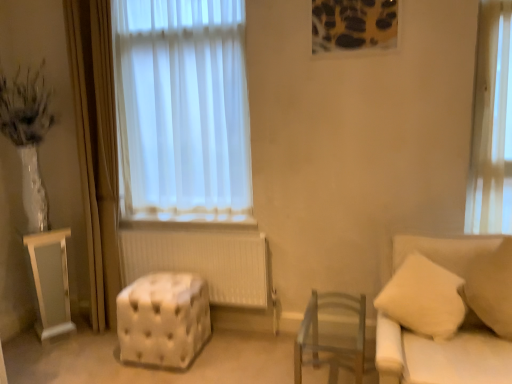
Question: Considering the relative sizes of white fabric couch at right and white tufted ottoman at center in the image provided, is white fabric couch at right taller than white tufted ottoman at center?

Choices:
 (A) yes
 (B) no

Answer: (A)

Question: From the image's perspective, is white fabric couch at right beneath white tufted ottoman at center?

Choices:
 (A) no
 (B) yes

Answer: (A)

Question: Is white fabric couch at right bigger than white tufted ottoman at center?

Choices:
 (A) yes
 (B) no

Answer: (A)

Question: Can we say white fabric couch at right lies outside white tufted ottoman at center?

Choices:
 (A) yes
 (B) no

Answer: (A)

Question: Does white fabric couch at right appear on the right side of white tufted ottoman at center?

Choices:
 (A) yes
 (B) no

Answer: (A)

Question: Considering their positions, is beige fabric pillow at right located in front of or behind white fabric couch at right?

Choices:
 (A) behind
 (B) front

Answer: (A)

Question: Would you say beige fabric pillow at right is to the left or to the right of white fabric couch at right in the picture?

Choices:
 (A) left
 (B) right

Answer: (B)

Question: Considering the positions of beige fabric pillow at right and white fabric couch at right in the image, is beige fabric pillow at right bigger or smaller than white fabric couch at right?

Choices:
 (A) small
 (B) big

Answer: (A)

Question: Considering the positions of beige fabric pillow at right and white fabric couch at right in the image, is beige fabric pillow at right wider or thinner than white fabric couch at right?

Choices:
 (A) thin
 (B) wide

Answer: (A)

Question: In terms of size, does clear wood chair at center appear bigger or smaller than beige fabric pillow at right?

Choices:
 (A) small
 (B) big

Answer: (B)

Question: Is clear wood chair at center wider or thinner than beige fabric pillow at right?

Choices:
 (A) thin
 (B) wide

Answer: (B)

Question: In terms of height, does clear wood chair at center look taller or shorter compared to beige fabric pillow at right?

Choices:
 (A) tall
 (B) short

Answer: (B)

Question: Is clear wood chair at center in front of or behind beige fabric pillow at right in the image?

Choices:
 (A) front
 (B) behind

Answer: (A)

Question: From their relative heights in the image, would you say white fabric couch at right is taller or shorter than beige fabric pillow at right?

Choices:
 (A) short
 (B) tall

Answer: (B)

Question: In terms of size, does white fabric couch at right appear bigger or smaller than beige fabric pillow at right?

Choices:
 (A) small
 (B) big

Answer: (B)